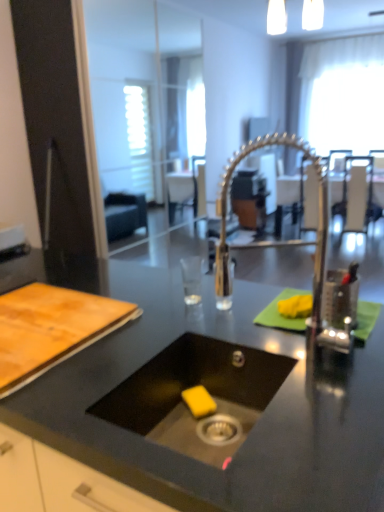
In order to click on free space behind polished metallic faucet at center in this screenshot , I will do `click(253, 327)`.